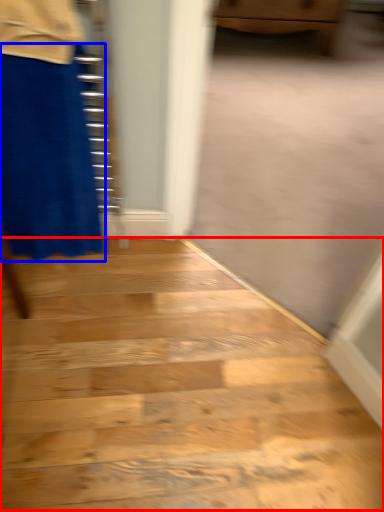
Question: Which of the following is the farthest to the observer, stairwell (highlighted by a red box) or miniskirt (highlighted by a blue box)?

Choices:
 (A) stairwell
 (B) miniskirt

Answer: (A)